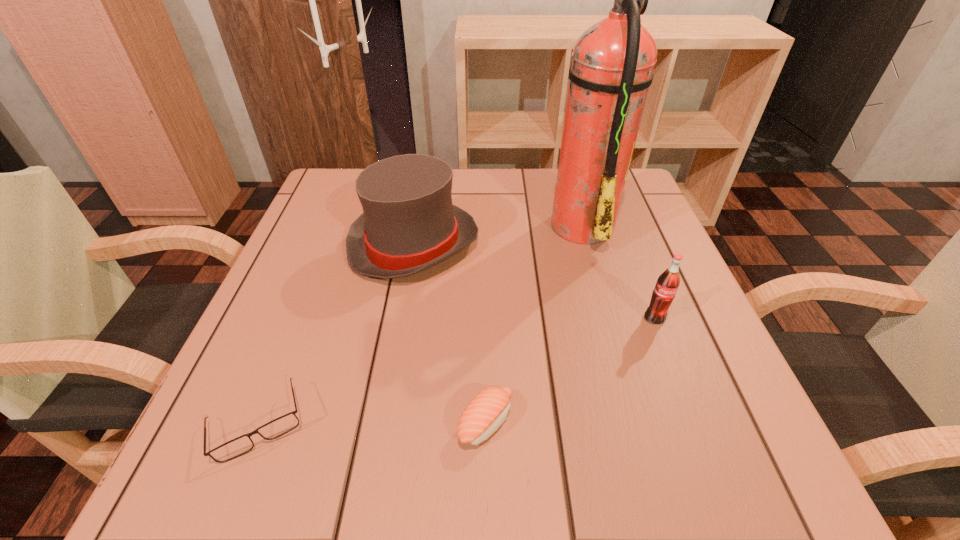
Where is `fire extinguisher`? The image size is (960, 540). fire extinguisher is located at coordinates (612, 66).

Image resolution: width=960 pixels, height=540 pixels. In order to click on dress hat in this screenshot , I will do [x=408, y=225].

Identify the location of the third nearest object. (668, 282).

Where is `the second shortest object`? The width and height of the screenshot is (960, 540). the second shortest object is located at coordinates (488, 410).

This screenshot has height=540, width=960. I want to click on the shortest object, so click(232, 449).

Where is `vacant space positioned 0.300m at the nozzle of the fire extinguisher`? vacant space positioned 0.300m at the nozzle of the fire extinguisher is located at coordinates (416, 223).

This screenshot has height=540, width=960. Find the location of `vacant space located 0.170m at the nozzle of the fire extinguisher`. vacant space located 0.170m at the nozzle of the fire extinguisher is located at coordinates (473, 223).

Identify the location of vacant point located 0.220m at the nozzle of the fire extinguisher. The image size is (960, 540). (451, 223).

This screenshot has height=540, width=960. I want to click on vacant space located on the right of the dress hat, so click(578, 244).

This screenshot has height=540, width=960. Identify the location of free location located 0.130m on the label of the soda bottle. (682, 391).